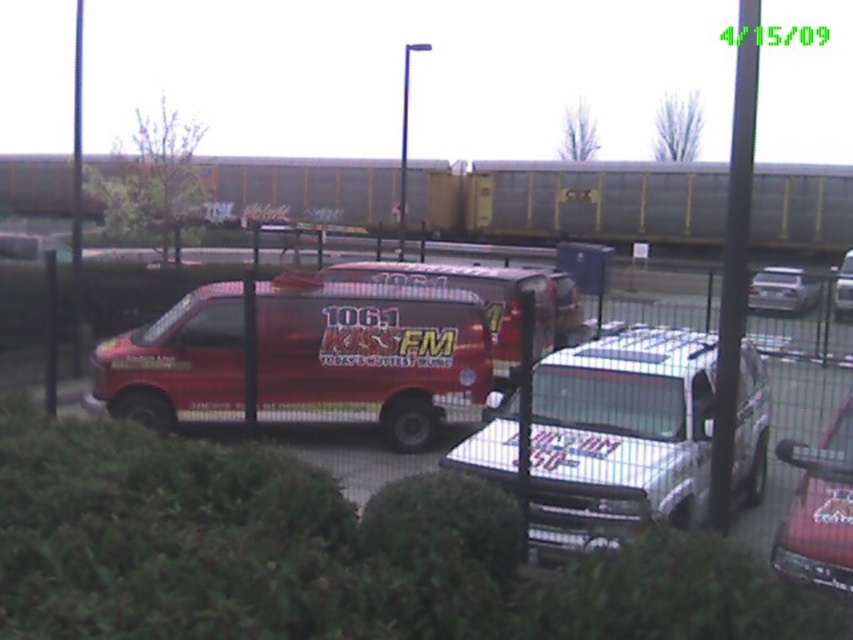
Question: Can you confirm if green leafy hedge at lower center is positioned to the right of metallic wire fence at center?

Choices:
 (A) no
 (B) yes

Answer: (A)

Question: Which of these objects is positioned closest to the shiny red van at center?

Choices:
 (A) metallic wire fence at center
 (B) white glossy truck at center

Answer: (A)

Question: Which of these objects is positioned farthest from the green leafy hedge at lower center?

Choices:
 (A) shiny red van at center
 (B) metallic wire fence at center

Answer: (B)

Question: Does white glossy truck at center appear on the left side of silver metallic sedan at center?

Choices:
 (A) no
 (B) yes

Answer: (B)

Question: Is metallic red van at center further to camera compared to silver metallic sedan at center?

Choices:
 (A) yes
 (B) no

Answer: (B)

Question: Which object appears closest to the camera in this image?

Choices:
 (A) white glossy truck at center
 (B) metallic red van at center
 (C) silver metallic sedan at center

Answer: (B)